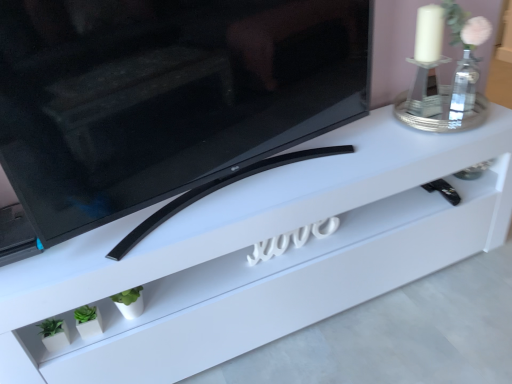
Describe the element at coordinates (437, 75) in the screenshot. This screenshot has height=384, width=512. I see `white glass candle holder at upper right` at that location.

Image resolution: width=512 pixels, height=384 pixels. What do you see at coordinates (262, 261) in the screenshot? I see `white glossy tv stand at center` at bounding box center [262, 261].

At what (x,y) coordinates should I click in order to perform the action: click on white glossy tv stand at center. Please return your answer as a coordinate pair (x, y). This screenshot has width=512, height=384. Looking at the image, I should click on (262, 261).

You are a GUI agent. You are given a task and a screenshot of the screen. Output one action in this format:
    pyautogui.click(x=<x>, y=<y>)
    Task: Click on the white glass candle holder at upper right
    The width and height of the screenshot is (512, 384).
    Given the screenshot: What is the action you would take?
    pyautogui.click(x=437, y=75)

Can you confirm if white matte planter at lower left is positioned to the right of white glossy tv stand at center?

No, white matte planter at lower left is not to the right of white glossy tv stand at center.

The width and height of the screenshot is (512, 384). In order to click on plant located above the white glossy tv stand at center (from a real-world perspective) in this screenshot , I will do `click(88, 321)`.

Is white matte planter at lower left situated inside white glossy tv stand at center or outside?

The correct answer is: inside.

The height and width of the screenshot is (384, 512). Find the location of `television below the white glass candle holder at upper right (from the image's perspective)`. television below the white glass candle holder at upper right (from the image's perspective) is located at coordinates (167, 99).

Considering the relative positions of white glass candle holder at upper right and black glossy tv at center in the image provided, is white glass candle holder at upper right to the left of black glossy tv at center from the viewer's perspective?

No, white glass candle holder at upper right is not to the left of black glossy tv at center.

Who is smaller, white glass candle holder at upper right or black glossy tv at center?

Smaller between the two is white glass candle holder at upper right.

From the image's perspective, is white glass candle holder at upper right located beneath black glossy tv at center?

No, from the image's perspective, white glass candle holder at upper right is not below black glossy tv at center.

How far apart are white glossy tv stand at center and white matte planter at lower left?

white glossy tv stand at center and white matte planter at lower left are 61.14 centimeters apart.

Between white glossy tv stand at center and white matte planter at lower left, which one has less height?

Standing shorter between the two is white matte planter at lower left.

From the image's perspective, which is below, white glossy tv stand at center or white matte planter at lower left?

From the image's view, white matte planter at lower left is below.

Does white glossy tv stand at center touch white matte planter at lower left?

They are not placed beside each other.

From the image's perspective, which one is positioned higher, black glossy tv at center or white matte planter at lower left?

From the image's view, black glossy tv at center is above.

How different are the orientations of black glossy tv at center and white matte planter at lower left in degrees?

The angle between the facing direction of black glossy tv at center and the facing direction of white matte planter at lower left is 7.7 degrees.

Can you confirm if black glossy tv at center is shorter than white matte planter at lower left?

In fact, black glossy tv at center may be taller than white matte planter at lower left.

Would you say black glossy tv at center is a long distance from white matte planter at lower left?

No, black glossy tv at center is in close proximity to white matte planter at lower left.

Is white glass candle holder at upper right far away from white glossy tv stand at center?

No.

Can you confirm if white glass candle holder at upper right is bigger than white glossy tv stand at center?

No.

How different are the orientations of white glass candle holder at upper right and white glossy tv stand at center in degrees?

They differ by 11.4 degrees in their facing directions.

Is white glossy tv stand at center surrounded by white glass candle holder at upper right?

No, white glossy tv stand at center is not inside white glass candle holder at upper right.

Can you confirm if white matte planter at lower left is wider than black glossy tv at center?

No.

Considering the relative sizes of white matte planter at lower left and black glossy tv at center in the image provided, is white matte planter at lower left taller than black glossy tv at center?

In fact, white matte planter at lower left may be shorter than black glossy tv at center.

Could you tell me if white matte planter at lower left is facing black glossy tv at center?

No.

What's the angular difference between white matte planter at lower left and black glossy tv at center's facing directions?

They differ by 7.7 degrees in their facing directions.

Is black glossy tv at center situated inside white glossy tv stand at center or outside?

black glossy tv at center is spatially situated outside white glossy tv stand at center.

From their relative heights in the image, would you say black glossy tv at center is taller or shorter than white glossy tv stand at center?

Clearly, black glossy tv at center is taller compared to white glossy tv stand at center.

From the image's perspective, is black glossy tv at center located above white glossy tv stand at center?

Yes.

Locate an element on the screen. The height and width of the screenshot is (384, 512). plant located above the white glossy tv stand at center (from a real-world perspective) is located at coordinates (88, 321).

This screenshot has width=512, height=384. I want to click on television in front of the white glass candle holder at upper right, so click(x=167, y=99).

Which object lies further to the anchor point white matte planter at lower left, black glossy tv at center or white glossy tv stand at center?

black glossy tv at center.

Which object lies nearer to the anchor point white glossy tv stand at center, white matte planter at lower left or white glass candle holder at upper right?

Based on the image, white glass candle holder at upper right appears to be nearer to white glossy tv stand at center.

From the image, which object appears to be farther from white glass candle holder at upper right, white glossy tv stand at center or black glossy tv at center?

Among the two, black glossy tv at center is located further to white glass candle holder at upper right.

In the scene shown: Considering their positions, is black glossy tv at center positioned closer to white glass candle holder at upper right than white glossy tv stand at center?

white glossy tv stand at center is closer to white glass candle holder at upper right.

When comparing their distances from white matte planter at lower left, does black glossy tv at center or white glass candle holder at upper right seem further?

white glass candle holder at upper right is positioned further to the anchor white matte planter at lower left.

Which object lies nearer to the anchor point white glossy tv stand at center, white matte planter at lower left or black glossy tv at center?

Among the two, black glossy tv at center is located nearer to white glossy tv stand at center.

Considering their positions, is white matte planter at lower left positioned closer to white glass candle holder at upper right than black glossy tv at center?

The object closer to white glass candle holder at upper right is black glossy tv at center.

Looking at the image, which one is located further to black glossy tv at center, white glossy tv stand at center or white matte planter at lower left?

Among the two, white matte planter at lower left is located further to black glossy tv at center.

Identify the location of furniture between black glossy tv at center and white glass candle holder at upper right from left to right. (262, 261).

At what (x,y) coordinates should I click in order to perform the action: click on furniture located between white matte planter at lower left and white glass candle holder at upper right in the left-right direction. Please return your answer as a coordinate pair (x, y). Image resolution: width=512 pixels, height=384 pixels. Looking at the image, I should click on (262, 261).

Identify the location of television located between white matte planter at lower left and white glass candle holder at upper right in the left-right direction. (167, 99).

Locate an element on the screen. furniture that lies between black glossy tv at center and white matte planter at lower left from top to bottom is located at coordinates (262, 261).